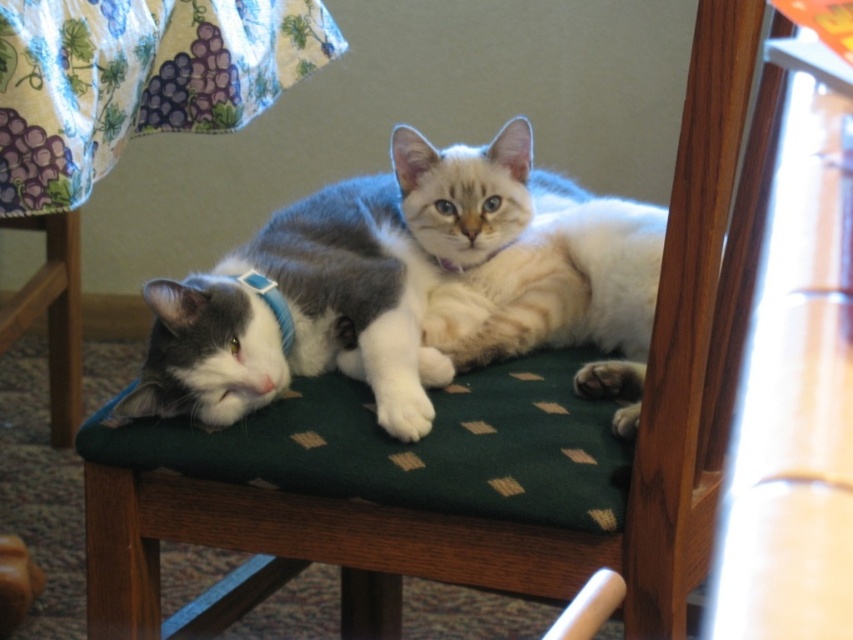
You are a photographer trying to capture a closeup of the gray matte fur cat at center without the light brown fur at center appearing in the background. Based on their positions, is this possible?

Since the gray matte fur cat at center is in front of the light brown fur at center, you can take a closeup of the gray matte fur cat at center so that the light brown fur at center is hidden behind it and won

You are standing in front of the chair with two cats. You want to place a small treat at the point closer to you between point (202, 376) and point (286, 349). Which point should you choose?

Point (202, 376) is closer to the viewer than point (286, 349), so you should choose point (202, 376) to place the treat.

You are trying to decide which item is wider between the light brown fur at center and the blue fabric neckband at left. Can you determine which one is wider?

The light brown fur at center is wider than the blue fabric neckband at left according to the description.